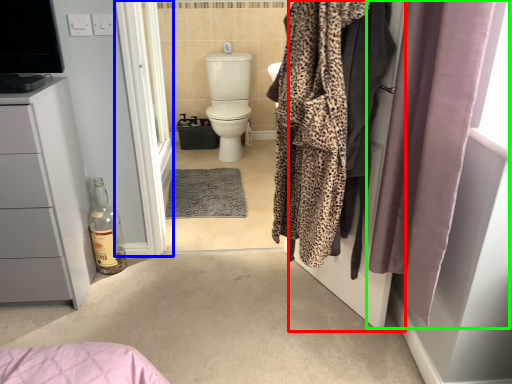
Question: Considering the real-world distances, which object is farthest from screen door (highlighted by a red box)? screen door (highlighted by a blue box) or curtain (highlighted by a green box)?

Choices:
 (A) screen door
 (B) curtain

Answer: (A)